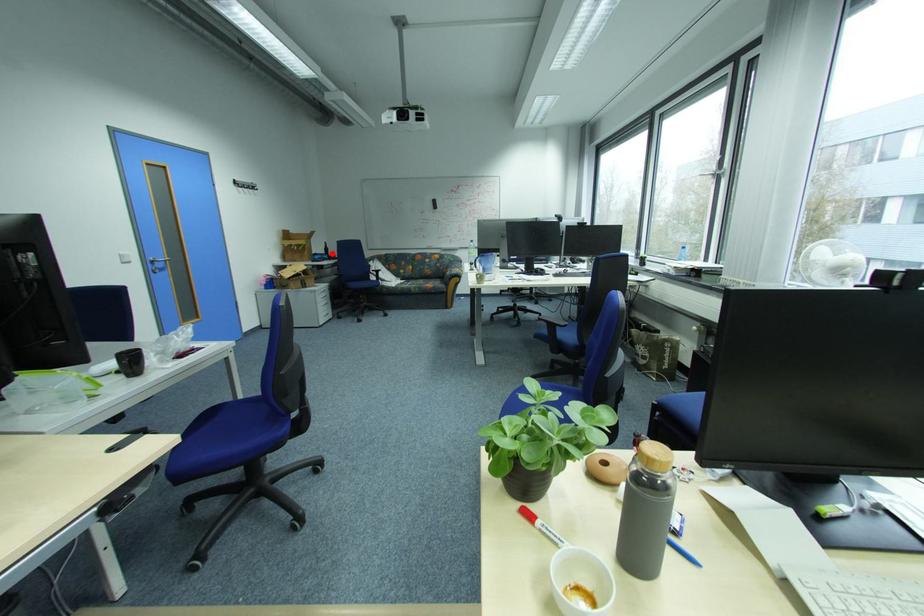
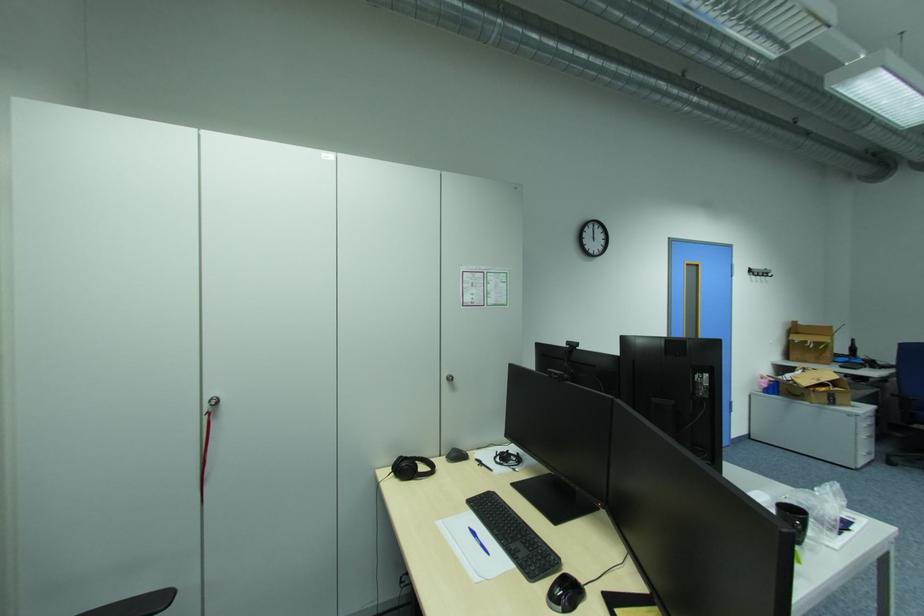
Question: I am providing you with two images of the same scene from different viewpoints. In image1, a red point is highlighted. Considering the same 3D point in image2, which of the following is correct?

Choices:
 (A) It is closer
 (B) It is farther

Answer: (B)